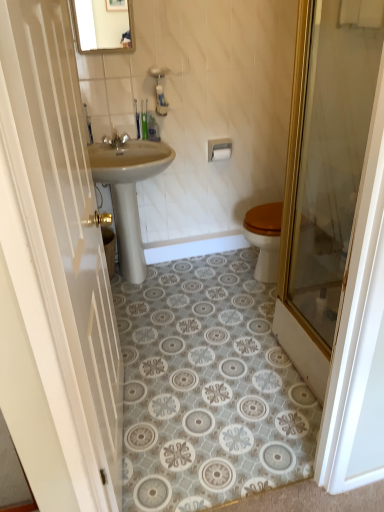
Question: Is white glossy door at left, arranged as the 1th door when viewed from the left, at the left side of beige ceramic sink at center?

Choices:
 (A) yes
 (B) no

Answer: (B)

Question: From a real-world perspective, is white glossy door at left, arranged as the 1th door when viewed from the left, positioned over beige ceramic sink at center based on gravity?

Choices:
 (A) yes
 (B) no

Answer: (A)

Question: Is beige ceramic sink at center at the back of white glossy door at left, the 2th door from the right?

Choices:
 (A) no
 (B) yes

Answer: (A)

Question: Is white glossy door at left, arranged as the 1th door when viewed from the left, not inside beige ceramic sink at center?

Choices:
 (A) yes
 (B) no

Answer: (A)

Question: Considering the relative sizes of white glossy door at left, the 2th door from the right, and beige ceramic sink at center in the image provided, is white glossy door at left, the 2th door from the right, taller than beige ceramic sink at center?

Choices:
 (A) no
 (B) yes

Answer: (B)

Question: From the image's perspective, is silver metallic faucet at upper center above or below white glossy door at left, arranged as the 1th door when viewed from the left?

Choices:
 (A) above
 (B) below

Answer: (A)

Question: From a real-world perspective, is silver metallic faucet at upper center physically located above or below white glossy door at left, the 2th door from the right?

Choices:
 (A) above
 (B) below

Answer: (A)

Question: Looking at their shapes, would you say silver metallic faucet at upper center is wider or thinner than white glossy door at left, arranged as the 1th door when viewed from the left?

Choices:
 (A) thin
 (B) wide

Answer: (A)

Question: Is silver metallic faucet at upper center taller or shorter than white glossy door at left, the 2th door from the right?

Choices:
 (A) short
 (B) tall

Answer: (A)

Question: Would you say white matte toilet paper at upper center is to the left or to the right of matte glass mirror at upper center in the picture?

Choices:
 (A) left
 (B) right

Answer: (B)

Question: Considering the positions of white matte toilet paper at upper center and matte glass mirror at upper center in the image, is white matte toilet paper at upper center wider or thinner than matte glass mirror at upper center?

Choices:
 (A) wide
 (B) thin

Answer: (A)

Question: From a real-world perspective, is white matte toilet paper at upper center above or below matte glass mirror at upper center?

Choices:
 (A) above
 (B) below

Answer: (B)

Question: Considering the positions of white matte toilet paper at upper center and matte glass mirror at upper center in the image, is white matte toilet paper at upper center bigger or smaller than matte glass mirror at upper center?

Choices:
 (A) big
 (B) small

Answer: (B)

Question: Considering the positions of white matte toilet paper at upper center and white glossy door at left, the 2th door from the right, in the image, is white matte toilet paper at upper center taller or shorter than white glossy door at left, the 2th door from the right,?

Choices:
 (A) tall
 (B) short

Answer: (B)

Question: Is white matte toilet paper at upper center inside or outside of white glossy door at left, the 2th door from the right?

Choices:
 (A) outside
 (B) inside

Answer: (A)